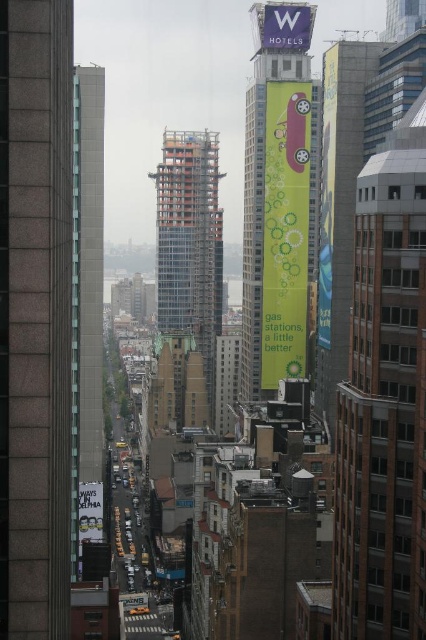
Is glassy orange tower at center above white fabric sign at upper center?

Incorrect, glassy orange tower at center is not positioned above white fabric sign at upper center.

Who is taller, glassy orange tower at center or white fabric sign at upper center?

glassy orange tower at center is taller.

What do you see at coordinates (189, 243) in the screenshot? I see `glassy orange tower at center` at bounding box center [189, 243].

Image resolution: width=426 pixels, height=640 pixels. Identify the location of glassy orange tower at center. (189, 243).

Identify the location of gray concrete skyscraper at center. (46, 308).

Can you confirm if gray concrete skyscraper at center is positioned to the right of white fabric sign at upper center?

Incorrect, gray concrete skyscraper at center is not on the right side of white fabric sign at upper center.

The width and height of the screenshot is (426, 640). I want to click on gray concrete skyscraper at center, so click(x=46, y=308).

Find the location of a particular element. gray concrete skyscraper at center is located at coordinates (46, 308).

Can you confirm if green fabric banner at center is bigger than white fabric sign at upper center?

Correct, green fabric banner at center is larger in size than white fabric sign at upper center.

Who is higher up, green fabric banner at center or white fabric sign at upper center?

white fabric sign at upper center is higher up.

Is point (247, 224) farther from camera compared to point (268, 20)?

Yes, it is.

At what (x,y) coordinates should I click in order to perform the action: click on green fabric banner at center. Please return your answer as a coordinate pair (x, y). Looking at the image, I should click on (267, 168).